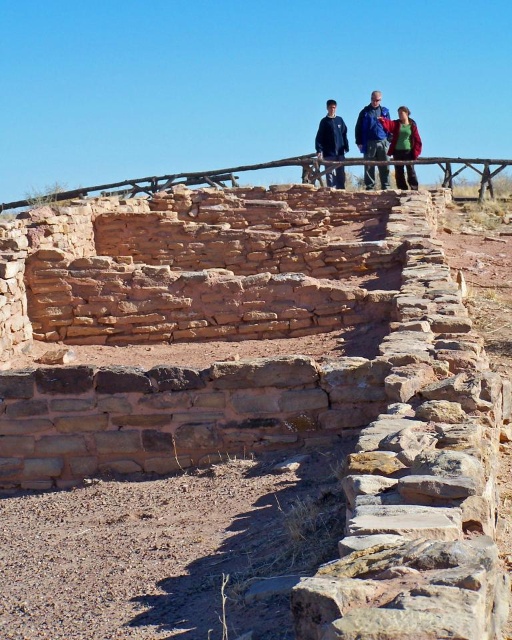
Question: Based on their relative distances, which object is farther from the blue denim jacket at upper center?

Choices:
 (A) brown wooden rail at upper center
 (B) dark blue jacket at upper center
 (C) green matte jacket at upper center

Answer: (A)

Question: Considering the relative positions of brown wooden rail at upper center and dark blue jacket at upper center in the image provided, where is brown wooden rail at upper center located with respect to dark blue jacket at upper center?

Choices:
 (A) below
 (B) above

Answer: (A)

Question: Does brown wooden rail at upper center have a greater width compared to blue denim jacket at upper center?

Choices:
 (A) no
 (B) yes

Answer: (B)

Question: Based on their relative distances, which object is farther from the brown wooden rail at upper center?

Choices:
 (A) blue denim jacket at upper center
 (B) dark blue jacket at upper center

Answer: (A)

Question: Among these points, which one is nearest to the camera?

Choices:
 (A) (407, 147)
 (B) (381, 186)
 (C) (317, 160)

Answer: (C)

Question: Does brown wooden rail at upper center come behind dark blue jacket at upper center?

Choices:
 (A) yes
 (B) no

Answer: (B)